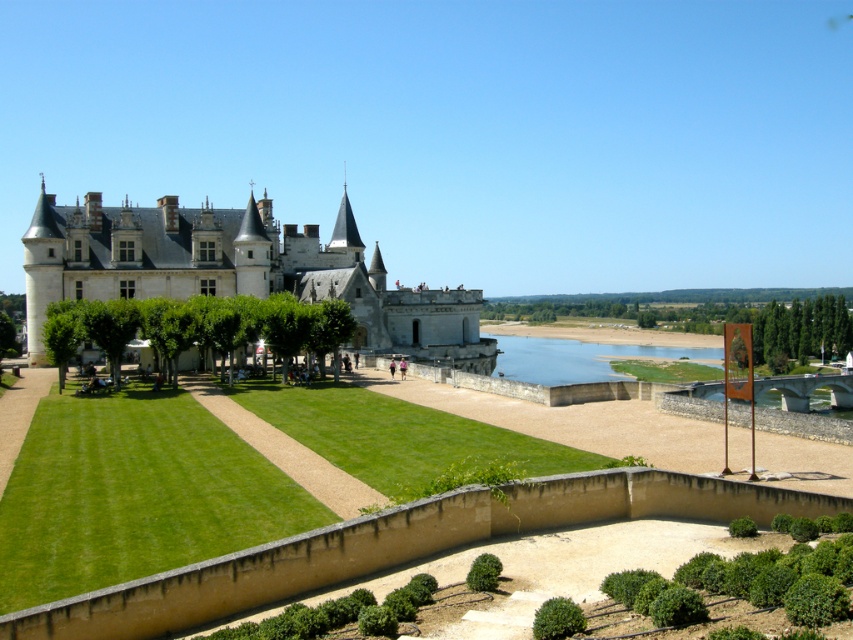
Based on the photo, which of these two, brown stone moat at lower center or green grassy lake at lower center, stands shorter?

brown stone moat at lower center is shorter.

Can you confirm if brown stone moat at lower center is wider than green grassy lake at lower center?

Incorrect, brown stone moat at lower center's width does not surpass green grassy lake at lower center's.

Between point (287, 554) and point (660, 349), which one is positioned in front?

Point (287, 554)

The width and height of the screenshot is (853, 640). Find the location of `brown stone moat at lower center`. brown stone moat at lower center is located at coordinates (398, 547).

Is brown stone moat at lower center bigger than white stone castle at center?

Actually, brown stone moat at lower center might be smaller than white stone castle at center.

Which is more to the right, brown stone moat at lower center or white stone castle at center?

brown stone moat at lower center

Describe the element at coordinates (398, 547) in the screenshot. I see `brown stone moat at lower center` at that location.

What are the coordinates of `brown stone moat at lower center` in the screenshot? It's located at (398, 547).

Does white stone castle at center have a larger size compared to green grassy lake at lower center?

Indeed, white stone castle at center has a larger size compared to green grassy lake at lower center.

Is point (378, 291) closer to camera compared to point (556, 364)?

Yes, it is.

You are a GUI agent. You are given a task and a screenshot of the screen. Output one action in this format:
    pyautogui.click(x=<x>, y=<y>)
    Task: Click on the white stone castle at center
    This screenshot has height=640, width=853.
    Given the screenshot: What is the action you would take?
    pyautogui.click(x=234, y=268)